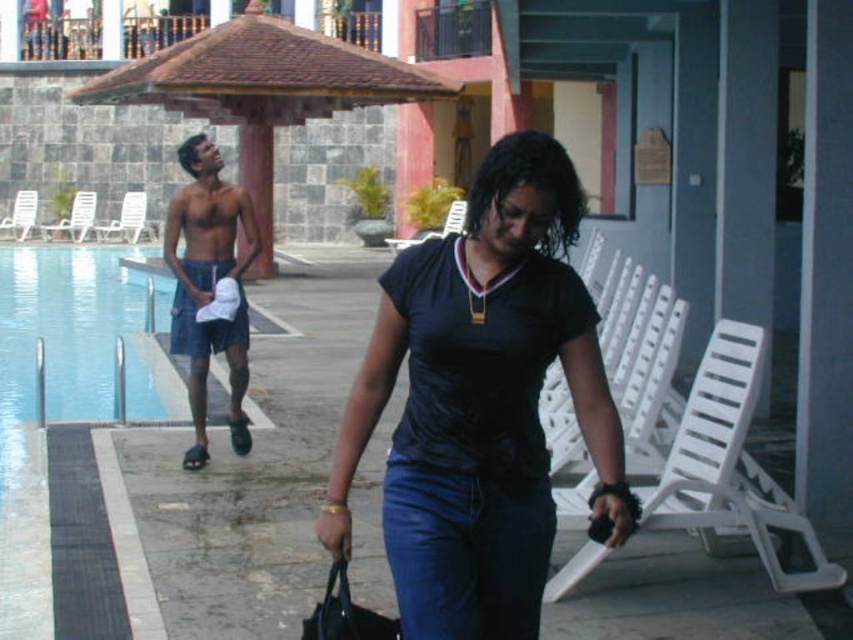
Where is the matte black shirt at center located in the image?

The matte black shirt at center is located at point coordinates of 0.631 on the x axis and 0.565 on the y axis.

You are a fashion designer analyzing the poolside scene. You need to determine which item has a greater width between the black matte bag at lower center and the brown leather sandal at lower left. Which one is wider?

The black matte bag at lower center is wider than the brown leather sandal at lower left according to the description.

You are a photographer positioned at the edge of the pool. You want to take a photo that includes both the blue denim shorts at left and the black matte bag at lower center. Given their distance apart, will they both fit in the frame if your camera has a field of view that can capture 5 meters width?

The blue denim shorts at left and black matte bag at lower center are 4.27 meters apart. Since the camera can capture 5 meters width, both objects will fit within the frame.